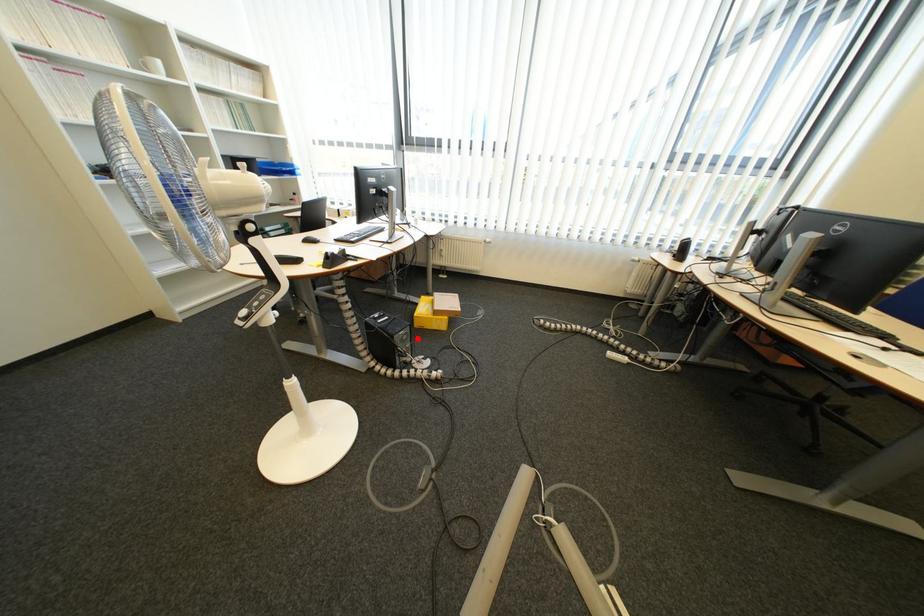
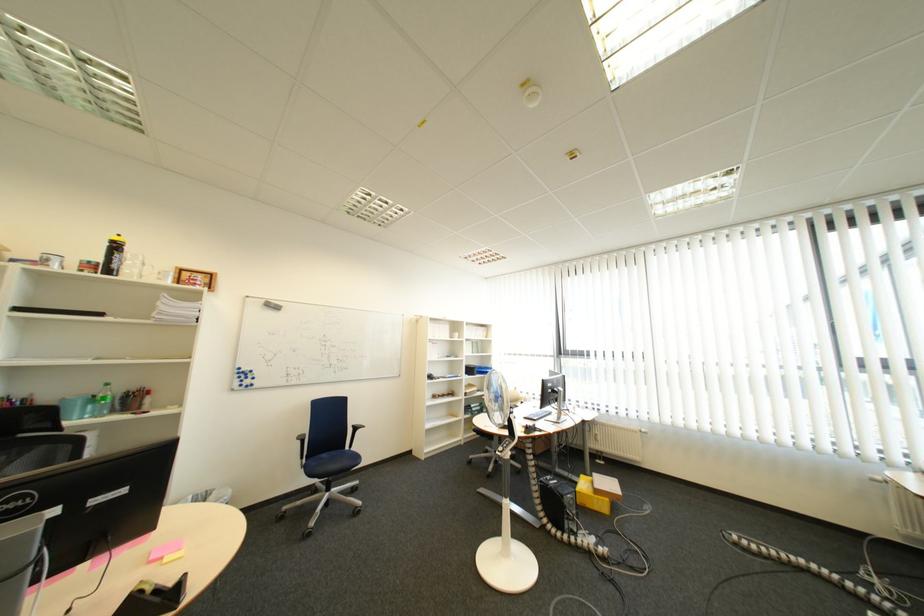
Question: I am providing you with two images of the same scene from different viewpoints. In image1, a red point is highlighted. Considering the same 3D point in image2, which of the following is correct?

Choices:
 (A) It is closer
 (B) It is farther

Answer: (B)